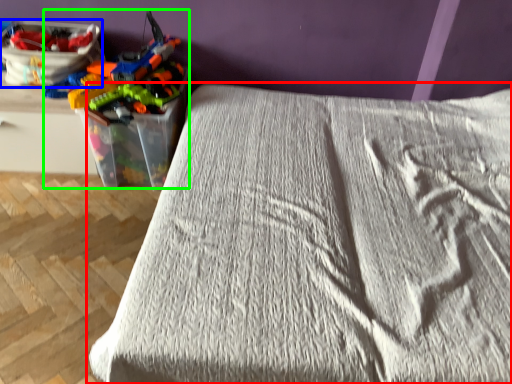
Question: Which object is positioned farthest from bed (highlighted by a red box)? Select from equipment (highlighted by a blue box) and toy (highlighted by a green box).

Choices:
 (A) equipment
 (B) toy

Answer: (A)